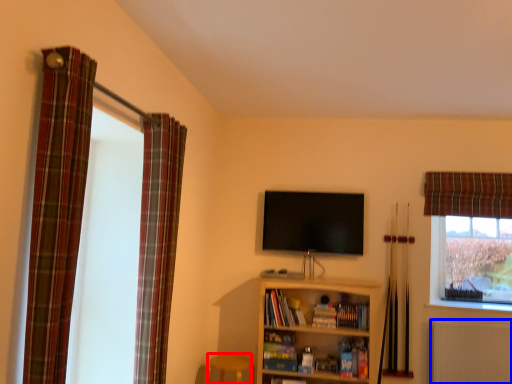
Question: Which object is closer to the camera taking this photo, bar stool (highlighted by a red box) or radiator (highlighted by a blue box)?

Choices:
 (A) bar stool
 (B) radiator

Answer: (A)